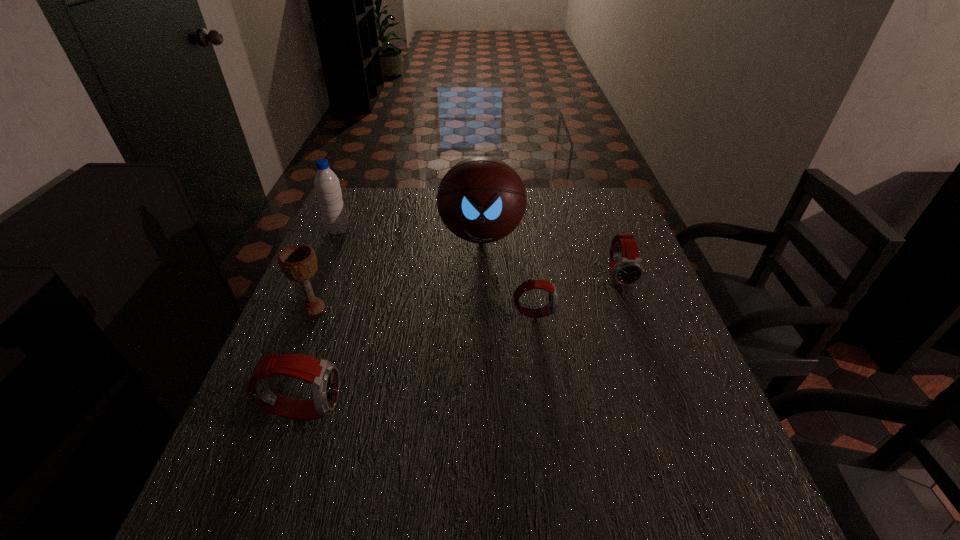
If equal spacing is the goal by inserting an additional watch among them, please point out a vacant space for this new watch. Please provide its 2D coordinates. Your answer should be formatted as a tuple, i.e. [(x, y)], where the tuple contains the x and y coordinates of a point satisfying the conditions above.

[(430, 356)]